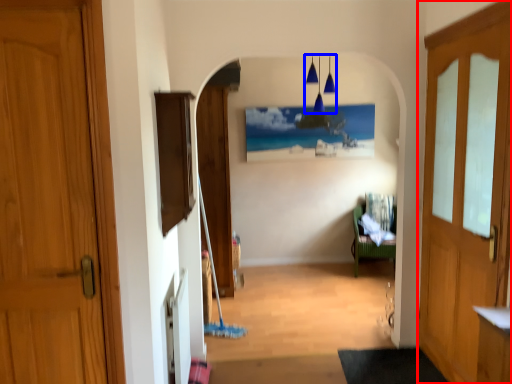
Question: Which object appears closest to the camera in this image, door (highlighted by a red box) or lamp (highlighted by a blue box)?

Choices:
 (A) door
 (B) lamp

Answer: (A)